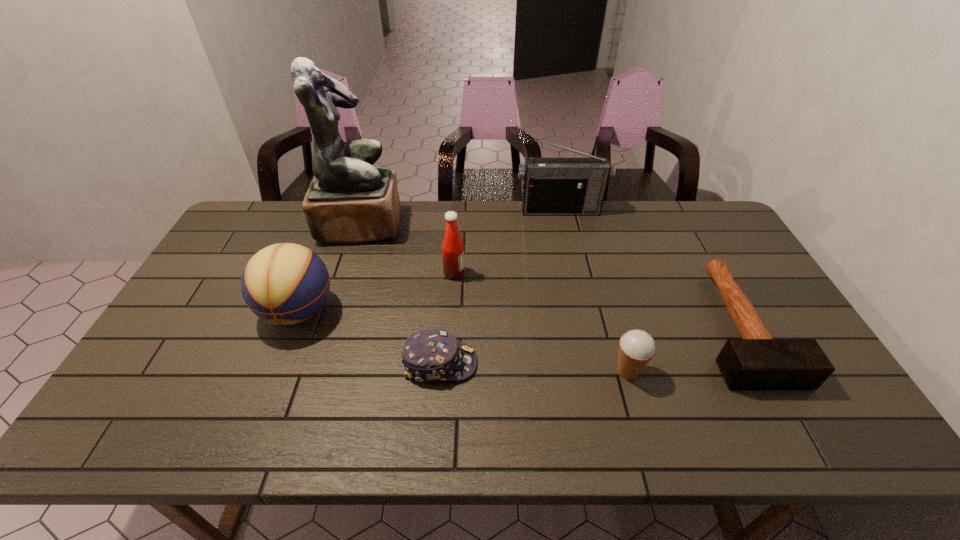
The image size is (960, 540). In order to click on the tallest object in this screenshot , I will do `click(349, 201)`.

Identify the location of radio receiver. This screenshot has height=540, width=960. (552, 186).

Locate an element on the screen. The width and height of the screenshot is (960, 540). condiment is located at coordinates tap(452, 247).

Where is `basketball`? The height and width of the screenshot is (540, 960). basketball is located at coordinates (285, 283).

Identify the location of the fifth tallest object. (636, 348).

Identify the location of the rightmost object. (757, 361).

You are a GUI agent. You are given a task and a screenshot of the screen. Output one action in this format:
    pyautogui.click(x=<x>, y=<y>)
    Task: Click on the headwear
    
    Given the screenshot: What is the action you would take?
    pyautogui.click(x=433, y=355)

Image resolution: width=960 pixels, height=540 pixels. In order to click on vacant space located 0.190m in a relaxed pose on the tallest object in this screenshot , I will do `click(456, 224)`.

The height and width of the screenshot is (540, 960). Find the location of `vacant region located 0.360m on the front-facing side of the radio receiver`. vacant region located 0.360m on the front-facing side of the radio receiver is located at coordinates (578, 288).

Image resolution: width=960 pixels, height=540 pixels. What are the coordinates of `vacant space situated on the front-facing side of the condiment` in the screenshot? It's located at (526, 273).